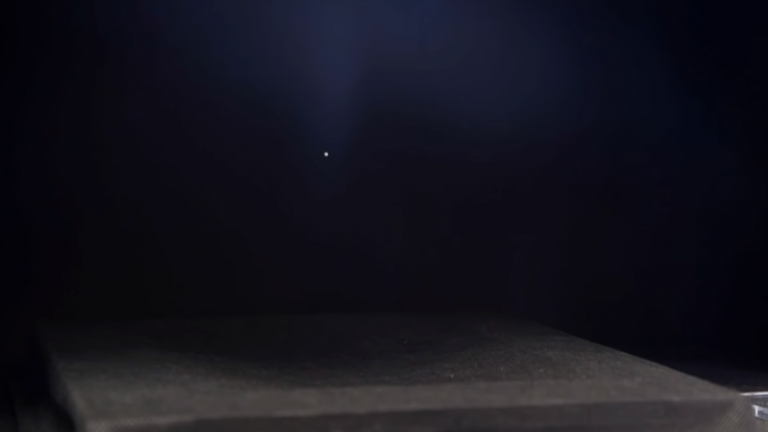
The height and width of the screenshot is (432, 768). I want to click on white object in corner, so click(x=760, y=396).